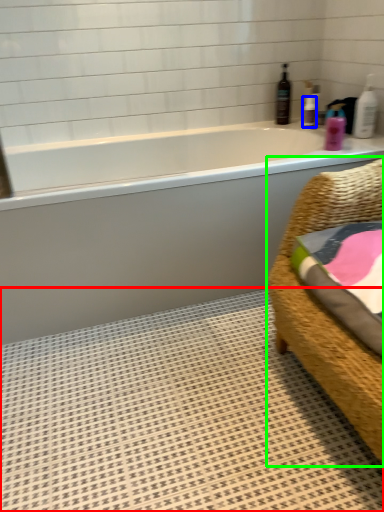
Question: Which is nearer to the bath mat (highlighted by a red box)? toiletry (highlighted by a blue box) or furniture (highlighted by a green box).

Choices:
 (A) toiletry
 (B) furniture

Answer: (B)